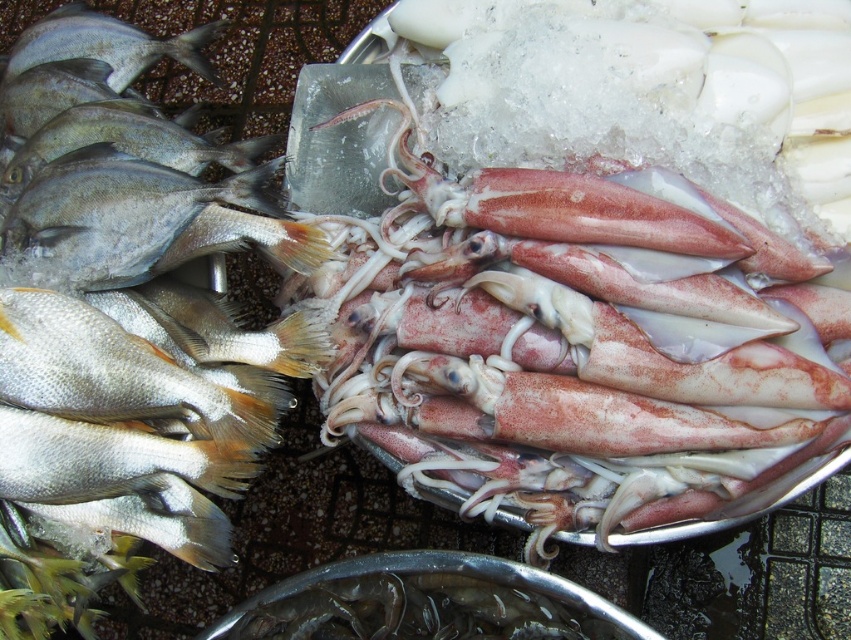
Between silver shiny fish at left and shiny silver fish at left, which one appears on the right side from the viewer's perspective?

Positioned to the right is silver shiny fish at left.

Find the location of a particular element. Image resolution: width=851 pixels, height=640 pixels. silver shiny fish at left is located at coordinates (140, 221).

Does point (215, 211) come behind point (33, 29)?

No, (215, 211) is in front of (33, 29).

Locate an element on the screen. silver shiny fish at left is located at coordinates (140, 221).